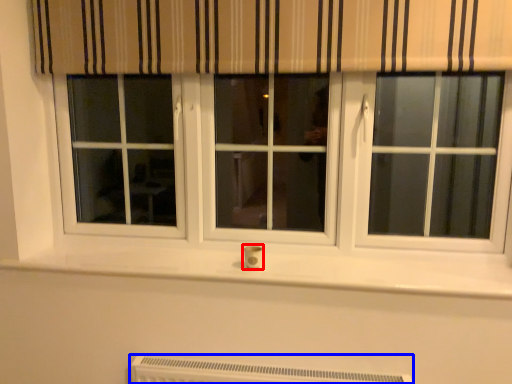
Question: Which object is further to the camera taking this photo, electric outlet (highlighted by a red box) or heater (highlighted by a blue box)?

Choices:
 (A) electric outlet
 (B) heater

Answer: (A)